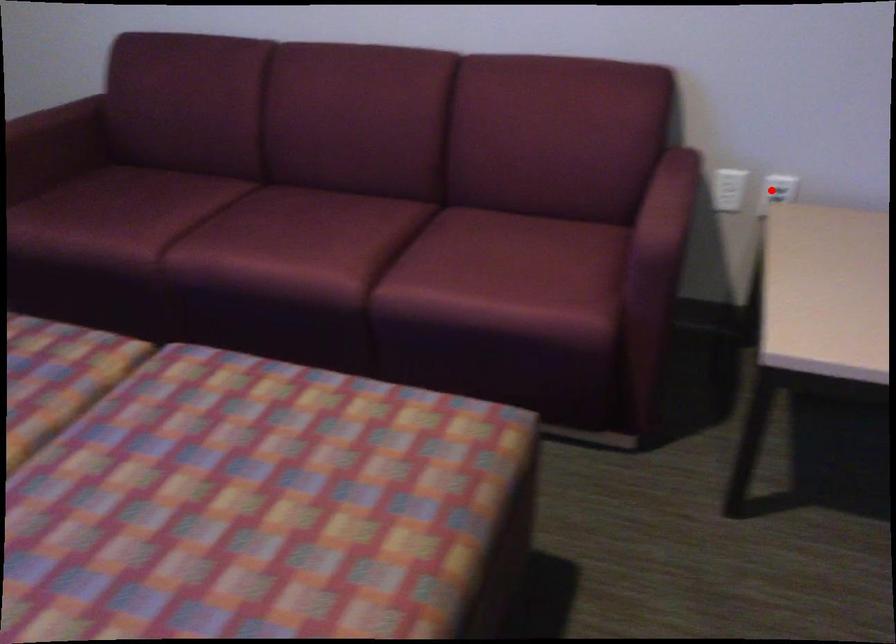
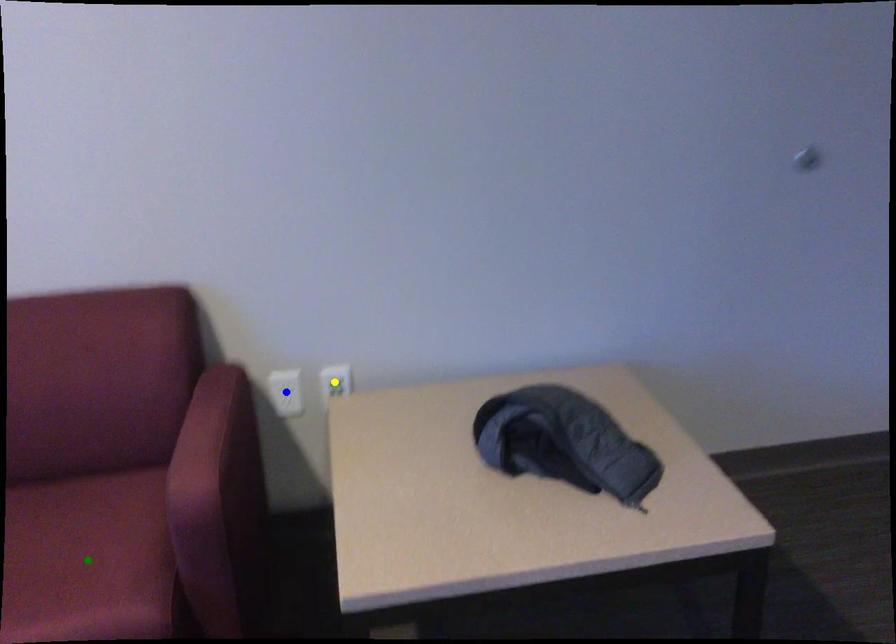
Question: I am providing you with two images of the same scene from different viewpoints. A red point is marked on the first image. You are given multiple points on the second image. Which point in image 2 is actually the same real-world point as the red point in image 1?

Choices:
 (A) yellow point
 (B) green point
 (C) blue point

Answer: (A)